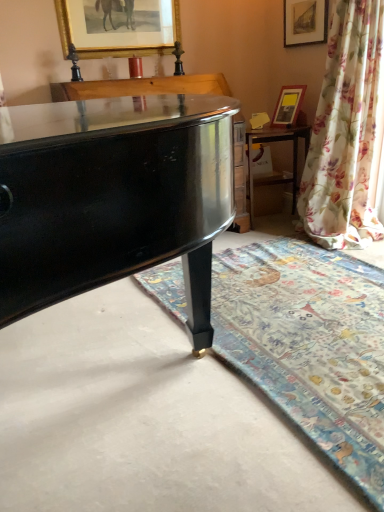
Question: Considering the positions of carpet with floral pattern at lower right and wooden table at right in the image, is carpet with floral pattern at lower right taller or shorter than wooden table at right?

Choices:
 (A) short
 (B) tall

Answer: (A)

Question: From a real-world perspective, relative to wooden table at right, is carpet with floral pattern at lower right vertically above or below?

Choices:
 (A) below
 (B) above

Answer: (A)

Question: Considering the real-world distances, which object is farthest from the floral fabric curtain at right?

Choices:
 (A) gold-framed picture at upper center, which is the first picture frame in left-to-right order
 (B) matte gold picture frame at upper right, which ranks as the first picture frame in right-to-left order
 (C) wooden table at right
 (D) matte gold picture frame at upper right, the 2th picture frame when ordered from left to right
 (E) carpet with floral pattern at lower right

Answer: (A)

Question: Estimate the real-world distances between objects in this image. Which object is closer to the matte gold picture frame at upper right, which appears as the second picture frame when viewed from the right?

Choices:
 (A) matte gold picture frame at upper right, which ranks as the first picture frame in right-to-left order
 (B) wooden table at right
 (C) gold-framed picture at upper center, which appears as the third picture frame when viewed from the right
 (D) floral fabric curtain at right
 (E) carpet with floral pattern at lower right

Answer: (B)